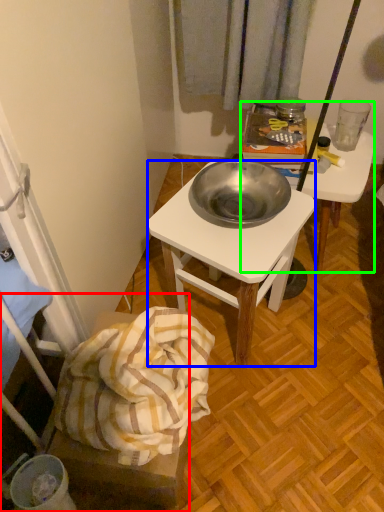
Question: Which is farther away from furniture (highlighted by a red box)? desk (highlighted by a blue box) or desk (highlighted by a green box)?

Choices:
 (A) desk
 (B) desk

Answer: (B)